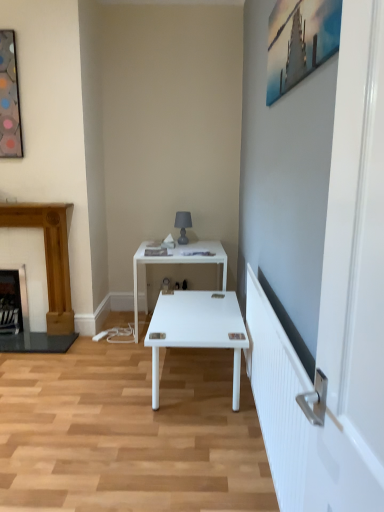
What do you see at coordinates (47, 276) in the screenshot? Image resolution: width=384 pixels, height=512 pixels. I see `wooden fireplace at left, which is the 1th fireplace in right-to-left order` at bounding box center [47, 276].

Measure the distance between metallic glass picture frame at upper left, the 1th picture frame viewed from the left, and camera.

metallic glass picture frame at upper left, the 1th picture frame viewed from the left, is 3.15 meters from camera.

The height and width of the screenshot is (512, 384). What do you see at coordinates (9, 99) in the screenshot?
I see `metallic glass picture frame at upper left, which appears as the second picture frame when viewed from the right` at bounding box center [9, 99].

At what (x,y) coordinates should I click in order to perform the action: click on metallic silver painting at upper right, placed as the 1th picture frame when sorted from right to left. Please return your answer as a coordinate pair (x, y). This screenshot has width=384, height=512. Looking at the image, I should click on (299, 41).

Image resolution: width=384 pixels, height=512 pixels. Find the location of `black metal fireplace at left, the 1th fireplace from the left`. black metal fireplace at left, the 1th fireplace from the left is located at coordinates (14, 303).

Does white glossy desk at center lie in front of wooden fireplace at left, which is the 1th fireplace in right-to-left order?

Yes, it is.

Does point (143, 248) come closer to viewer compared to point (51, 218)?

No.

Are white glossy desk at center and wooden fireplace at left, placed as the second fireplace when sorted from left to right, located far from each other?

No, there isn't a large distance between white glossy desk at center and wooden fireplace at left, placed as the second fireplace when sorted from left to right.

From a real-world perspective, is white glossy desk at center positioned under wooden fireplace at left, placed as the second fireplace when sorted from left to right, based on gravity?

Yes, from a real-world perspective, white glossy desk at center is below wooden fireplace at left, placed as the second fireplace when sorted from left to right.

Could you tell me if metallic glass picture frame at upper left, acting as the 2th picture frame starting from the front, is facing wooden fireplace at left, which is the 1th fireplace in right-to-left order?

No, metallic glass picture frame at upper left, acting as the 2th picture frame starting from the front, does not turn towards wooden fireplace at left, which is the 1th fireplace in right-to-left order.

Considering the relative sizes of metallic glass picture frame at upper left, which appears as the second picture frame when viewed from the right, and wooden fireplace at left, placed as the second fireplace when sorted from left to right, in the image provided, is metallic glass picture frame at upper left, which appears as the second picture frame when viewed from the right, bigger than wooden fireplace at left, placed as the second fireplace when sorted from left to right,?

No.

Which is more to the left, metallic glass picture frame at upper left, acting as the 2th picture frame starting from the front, or wooden fireplace at left, which is the 1th fireplace in right-to-left order?

Positioned to the left is metallic glass picture frame at upper left, acting as the 2th picture frame starting from the front.

Can you confirm if wooden fireplace at left, placed as the second fireplace when sorted from left to right, is smaller than metallic silver painting at upper right, the second picture frame from the back?

No.

Is wooden fireplace at left, placed as the second fireplace when sorted from left to right, facing towards metallic silver painting at upper right, the second picture frame positioned from the left?

No, wooden fireplace at left, placed as the second fireplace when sorted from left to right, is not turned towards metallic silver painting at upper right, the second picture frame positioned from the left.

Is metallic silver painting at upper right, placed as the 1th picture frame when sorted from right to left, located within wooden fireplace at left, placed as the second fireplace when sorted from left to right?

No, metallic silver painting at upper right, placed as the 1th picture frame when sorted from right to left, is not inside wooden fireplace at left, placed as the second fireplace when sorted from left to right.

Between wooden fireplace at left, placed as the second fireplace when sorted from left to right, and metallic silver painting at upper right, the second picture frame positioned from the left, which one has more height?

With more height is wooden fireplace at left, placed as the second fireplace when sorted from left to right.

From the image's perspective, is black metal fireplace at left, the 1th fireplace from the left, on white glossy desk at center?

Actually, black metal fireplace at left, the 1th fireplace from the left, appears below white glossy desk at center in the image.

Which object is thinner, black metal fireplace at left, the 1th fireplace from the left, or white glossy desk at center?

black metal fireplace at left, the 1th fireplace from the left, is thinner.

From a real-world perspective, does black metal fireplace at left, the 1th fireplace from the left, sit lower than white glossy desk at center?

Correct, in the physical world, black metal fireplace at left, the 1th fireplace from the left, is lower than white glossy desk at center.

Is metallic glass picture frame at upper left, which appears as the second picture frame when viewed from the right, placed right next to black metal fireplace at left, the 1th fireplace from the left?

There is a gap between metallic glass picture frame at upper left, which appears as the second picture frame when viewed from the right, and black metal fireplace at left, the 1th fireplace from the left.

Could you tell me if metallic glass picture frame at upper left, acting as the 2th picture frame starting from the front, is turned towards black metal fireplace at left, the 1th fireplace from the left?

No, metallic glass picture frame at upper left, acting as the 2th picture frame starting from the front, is not turned towards black metal fireplace at left, the 1th fireplace from the left.

Which is less distant, [14,92] or [25,331]?

Point [14,92] is positioned closer to the camera compared to point [25,331].

Is metallic glass picture frame at upper left, acting as the 2th picture frame starting from the front, wider or thinner than black metal fireplace at left, the 1th fireplace from the left?

Clearly, metallic glass picture frame at upper left, acting as the 2th picture frame starting from the front, has less width compared to black metal fireplace at left, the 1th fireplace from the left.

Is wooden fireplace at left, which is the 1th fireplace in right-to-left order, inside the boundaries of black metal fireplace at left, the 1th fireplace from the left, or outside?

wooden fireplace at left, which is the 1th fireplace in right-to-left order, is located beyond the bounds of black metal fireplace at left, the 1th fireplace from the left.

From the image's perspective, does wooden fireplace at left, which is the 1th fireplace in right-to-left order, appear higher than black metal fireplace at left, placed as the 2th fireplace when sorted from right to left?

Yes, from the image's perspective, wooden fireplace at left, which is the 1th fireplace in right-to-left order, is on top of black metal fireplace at left, placed as the 2th fireplace when sorted from right to left.

Considering their positions, is wooden fireplace at left, which is the 1th fireplace in right-to-left order, located in front of or behind black metal fireplace at left, placed as the 2th fireplace when sorted from right to left?

wooden fireplace at left, which is the 1th fireplace in right-to-left order, is in front of black metal fireplace at left, placed as the 2th fireplace when sorted from right to left.

Consider the image. Is black metal fireplace at left, placed as the 2th fireplace when sorted from right to left, looking in the opposite direction of metallic silver painting at upper right, the second picture frame positioned from the left?

black metal fireplace at left, placed as the 2th fireplace when sorted from right to left, is not turned away from metallic silver painting at upper right, the second picture frame positioned from the left.

Can you tell me how much black metal fireplace at left, the 1th fireplace from the left, and metallic silver painting at upper right, the second picture frame positioned from the left, differ in facing direction?

The facing directions of black metal fireplace at left, the 1th fireplace from the left, and metallic silver painting at upper right, the second picture frame positioned from the left, are 90.5 degrees apart.

Which object is thinner, black metal fireplace at left, the 1th fireplace from the left, or metallic silver painting at upper right, the second picture frame positioned from the left?

metallic silver painting at upper right, the second picture frame positioned from the left.

Considering the sizes of objects black metal fireplace at left, the 1th fireplace from the left, and metallic silver painting at upper right, the second picture frame from the back, in the image provided, who is bigger, black metal fireplace at left, the 1th fireplace from the left, or metallic silver painting at upper right, the second picture frame from the back,?

black metal fireplace at left, the 1th fireplace from the left.

At what (x,y) coordinates should I click in order to perform the action: click on desk below the wooden fireplace at left, which is the 1th fireplace in right-to-left order (from the image's perspective). Please return your answer as a coordinate pair (x, y). Image resolution: width=384 pixels, height=512 pixels. Looking at the image, I should click on (181, 264).

Identify the location of the 2nd picture frame above when counting from the wooden fireplace at left, placed as the second fireplace when sorted from left to right (from the image's perspective). (9, 99).

Based on the photo, when comparing their distances from matte gray lamp at upper center, does white glossy desk at center or metallic silver painting at upper right, the second picture frame positioned from the left, seem closer?

white glossy desk at center.

Based on their spatial positions, is metallic silver painting at upper right, placed as the 1th picture frame when sorted from right to left, or black metal fireplace at left, the 1th fireplace from the left, further from wooden fireplace at left, placed as the second fireplace when sorted from left to right?

metallic silver painting at upper right, placed as the 1th picture frame when sorted from right to left.

Looking at the image, which one is located closer to white glossy desk at center, wooden fireplace at left, placed as the second fireplace when sorted from left to right, or metallic glass picture frame at upper left, which ranks as the first picture frame in back-to-front order?

The object closer to white glossy desk at center is wooden fireplace at left, placed as the second fireplace when sorted from left to right.

From the picture: Looking at the image, which one is located further to matte gray lamp at upper center, wooden fireplace at left, placed as the second fireplace when sorted from left to right, or white glossy desk at center?

wooden fireplace at left, placed as the second fireplace when sorted from left to right, is further to matte gray lamp at upper center.

From the image, which object appears to be farther from metallic glass picture frame at upper left, the 1th picture frame viewed from the left, wooden fireplace at left, which is the 1th fireplace in right-to-left order, or black metal fireplace at left, the 1th fireplace from the left?

black metal fireplace at left, the 1th fireplace from the left, is further to metallic glass picture frame at upper left, the 1th picture frame viewed from the left.

Estimate the real-world distances between objects in this image. Which object is closer to metallic glass picture frame at upper left, acting as the 2th picture frame starting from the front, white glossy desk at center or black metal fireplace at left, the 1th fireplace from the left?

The object closer to metallic glass picture frame at upper left, acting as the 2th picture frame starting from the front, is black metal fireplace at left, the 1th fireplace from the left.

From the picture: Which object lies further to the anchor point white glossy desk at center, wooden fireplace at left, placed as the second fireplace when sorted from left to right, or metallic silver painting at upper right, which is the 1th picture frame in front-to-back order?

metallic silver painting at upper right, which is the 1th picture frame in front-to-back order, is further to white glossy desk at center.

When comparing their distances from metallic silver painting at upper right, the second picture frame from the back, does wooden fireplace at left, placed as the second fireplace when sorted from left to right, or matte gray lamp at upper center seem further?

wooden fireplace at left, placed as the second fireplace when sorted from left to right, lies further to metallic silver painting at upper right, the second picture frame from the back, than the other object.

At what (x,y) coordinates should I click in order to perform the action: click on picture frame between metallic silver painting at upper right, which is the 1th picture frame in front-to-back order, and black metal fireplace at left, placed as the 2th fireplace when sorted from right to left, in the front-back direction. Please return your answer as a coordinate pair (x, y). Looking at the image, I should click on (9, 99).

You are a GUI agent. You are given a task and a screenshot of the screen. Output one action in this format:
    pyautogui.click(x=<x>, y=<y>)
    Task: Click on the picture frame between black metal fireplace at left, placed as the 2th fireplace when sorted from right to left, and matte gray lamp at upper center from left to right
    
    Given the screenshot: What is the action you would take?
    point(9,99)

Locate an element on the screen. This screenshot has width=384, height=512. fireplace between metallic glass picture frame at upper left, the 1th picture frame viewed from the left, and black metal fireplace at left, placed as the 2th fireplace when sorted from right to left, vertically is located at coordinates (47, 276).

Where is `desk between metallic silver painting at upper right, the second picture frame positioned from the left, and black metal fireplace at left, placed as the 2th fireplace when sorted from right to left, from front to back`? desk between metallic silver painting at upper right, the second picture frame positioned from the left, and black metal fireplace at left, placed as the 2th fireplace when sorted from right to left, from front to back is located at coordinates (181, 264).